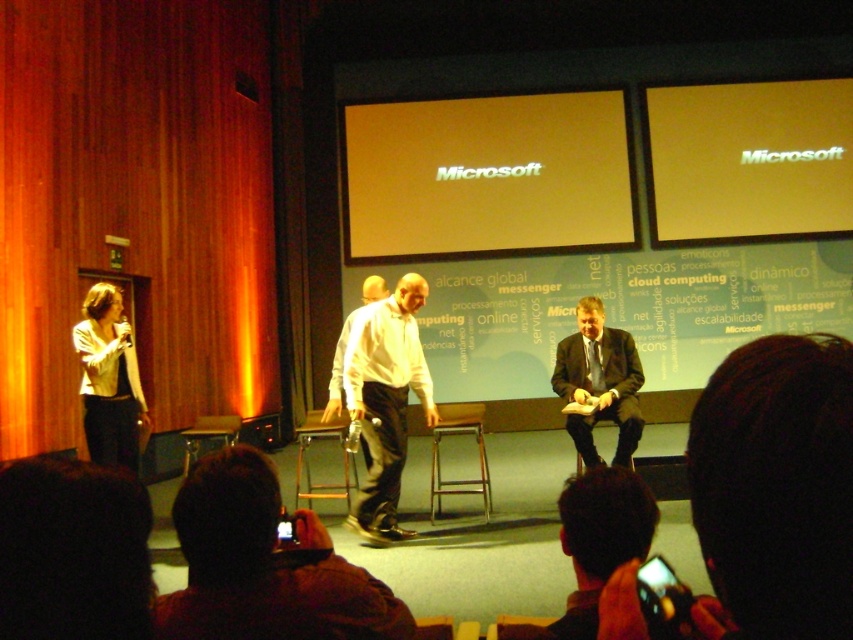
Can you confirm if yellow matte projection screen at center is positioned above white matte shirt at center?

Indeed, yellow matte projection screen at center is positioned over white matte shirt at center.

Which is below, yellow matte projection screen at center or white matte shirt at center?

Positioned lower is white matte shirt at center.

Measure the distance between yellow matte projection screen at center and camera.

yellow matte projection screen at center is 11.14 meters from camera.

Where is `yellow matte projection screen at center`? yellow matte projection screen at center is located at coordinates (486, 177).

Is metallic gold chair at center wider than wooden at center?

No.

Who is shorter, metallic gold chair at center or wooden at center?

Standing shorter between the two is metallic gold chair at center.

Find the location of a particular element. Image resolution: width=853 pixels, height=640 pixels. metallic gold chair at center is located at coordinates (477, 449).

Is silky black hair at lower right shorter than white shirt at center?

Yes.

Is silky black hair at lower right positioned behind white shirt at center?

No, it is in front of white shirt at center.

Between point (614, 513) and point (345, 346), which one is positioned in front?

Point (614, 513) is in front.

The image size is (853, 640). I want to click on silky black hair at lower right, so click(601, 538).